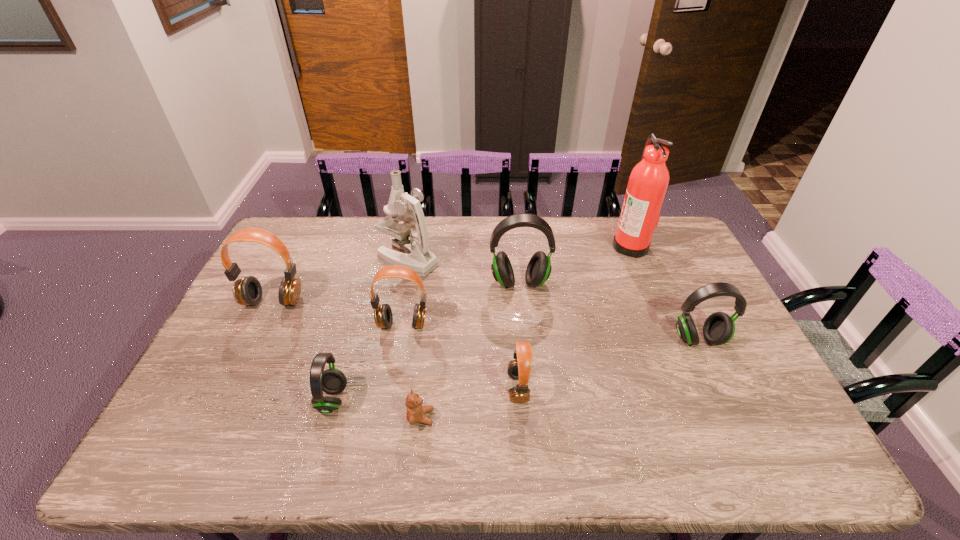
You are a GUI agent. You are given a task and a screenshot of the screen. Output one action in this format:
    pyautogui.click(x=<x>, y=<y>)
    Task: Click on the fire extinguisher
    This screenshot has width=960, height=540.
    Given the screenshot: What is the action you would take?
    pyautogui.click(x=649, y=179)

In order to click on microscope in this screenshot , I will do coord(416,255).

You are a GUI agent. You are given a task and a screenshot of the screen. Output one action in this format:
    pyautogui.click(x=<x>, y=<y>)
    Task: Click on the second tallest object
    The height and width of the screenshot is (540, 960).
    Given the screenshot: What is the action you would take?
    pyautogui.click(x=416, y=255)

This screenshot has width=960, height=540. Find the location of `the second black headset from left to right`. the second black headset from left to right is located at coordinates (538, 270).

Where is `the biggest black headset`? the biggest black headset is located at coordinates (538, 270).

Image resolution: width=960 pixels, height=540 pixels. Identify the location of the leftmost headset. (247, 291).

Where is `the leftmost brown headset`? the leftmost brown headset is located at coordinates (247, 291).

This screenshot has width=960, height=540. In order to click on the rightmost headset in this screenshot , I will do tap(719, 328).

Identify the location of the second farthest black headset. This screenshot has height=540, width=960. (719, 328).

Where is `the second nearest brown headset`? the second nearest brown headset is located at coordinates coord(383,316).